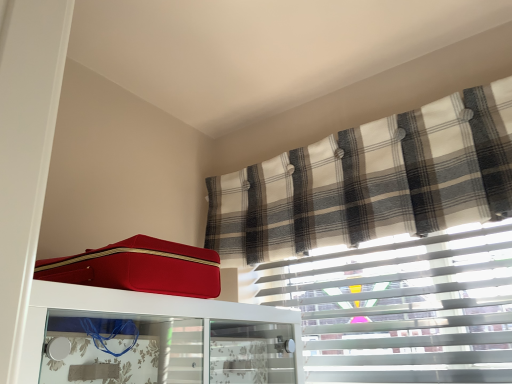
Question: Is plaid fabric curtain at upper right inside or outside of matte red suitcase at upper left?

Choices:
 (A) outside
 (B) inside

Answer: (A)

Question: Based on their sizes in the image, would you say plaid fabric curtain at upper right is bigger or smaller than matte red suitcase at upper left?

Choices:
 (A) small
 (B) big

Answer: (A)

Question: Which of these objects is positioned farthest from the plaid fabric curtain at upper right?

Choices:
 (A) matte red suitcase at upper left
 (B) matte red suitcase at upper left

Answer: (A)

Question: Which object is positioned closest to the matte red suitcase at upper left?

Choices:
 (A) matte red suitcase at upper left
 (B) plaid fabric curtain at upper right

Answer: (A)